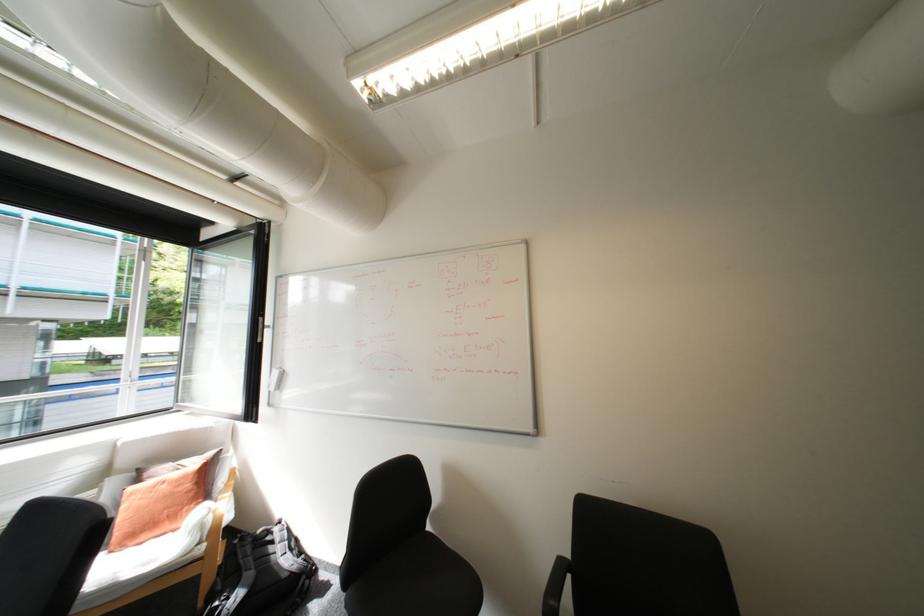
What do you see at coordinates (261, 329) in the screenshot? I see `the black window handle` at bounding box center [261, 329].